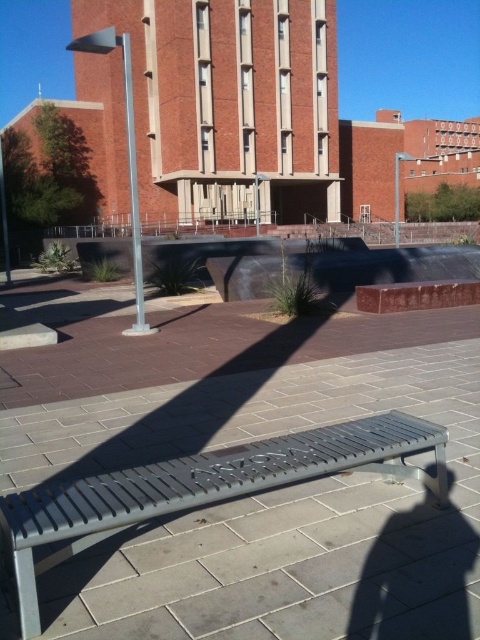
Question: Estimate the real-world distances between objects in this image. Which object is farther from the gray metal bench at center?

Choices:
 (A) silver metallic pole at left
 (B) metallic gray pole at center

Answer: (B)

Question: Does gray metal bench at center appear on the right side of metallic gray pole at center?

Choices:
 (A) yes
 (B) no

Answer: (B)

Question: Which point is farther to the camera?

Choices:
 (A) (395, 188)
 (B) (194, 600)

Answer: (A)

Question: Which of these objects is positioned farthest from the silver metallic pole at left?

Choices:
 (A) gray metal bench at center
 (B) metallic gray pole at center

Answer: (B)

Question: Is gray metal bench at center in front of metallic gray pole at center?

Choices:
 (A) yes
 (B) no

Answer: (A)

Question: Is gray metal bench at center smaller than silver metallic pole at left?

Choices:
 (A) yes
 (B) no

Answer: (A)